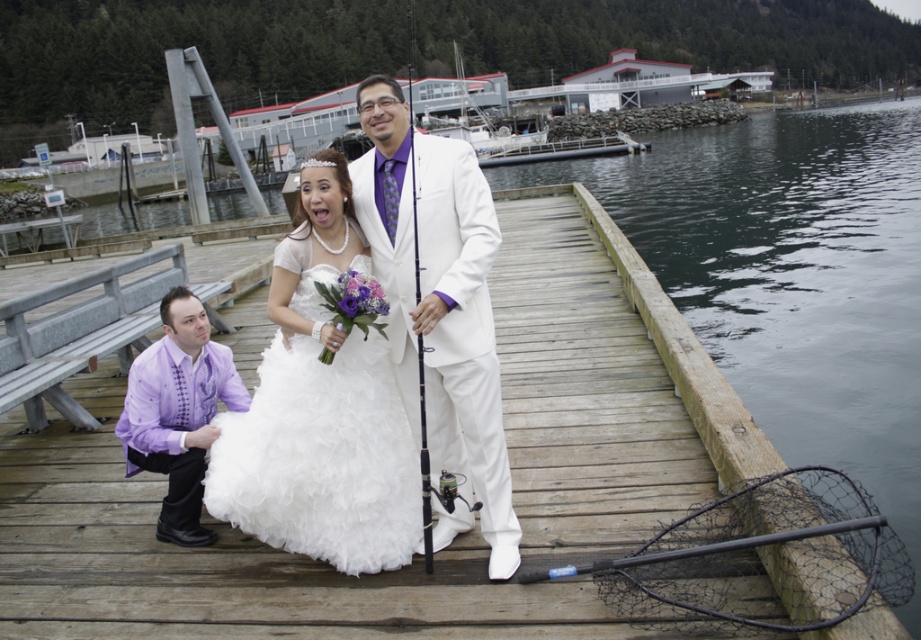
You are a photographer trying to capture a photo of the white satin dress at center and the black matte fishing pole at center. Based on their positions, which object is closer to the water surface?

The white satin dress at center is located below the black matte fishing pole at center, so the white satin dress at center is closer to the water surface.

You are a photographer trying to capture a closeup of the purple satin shirt at lower left and the black matte fishing pole at center. Which object should you zoom in on first if you want to focus on the thinner one?

The purple satin shirt at lower left is thinner than the black matte fishing pole at center, so you should focus on the purple satin shirt at lower left first.

You are standing on the wooden dock and want to hand the black matte fishing pole at center to the person wearing the purple satin shirt at lower left. Based on their positions, which direction should you move the fishing pole to reach them?

The purple satin shirt at lower left is to the right of the black matte fishing pole at center, so you should move the fishing pole to the right to reach the person wearing the purple satin shirt at lower left.